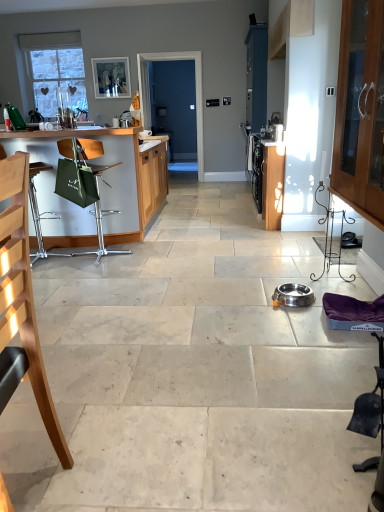
Identify the location of free space in front of green fabric chair at left, placed as the first chair when sorted from back to front. (88, 272).